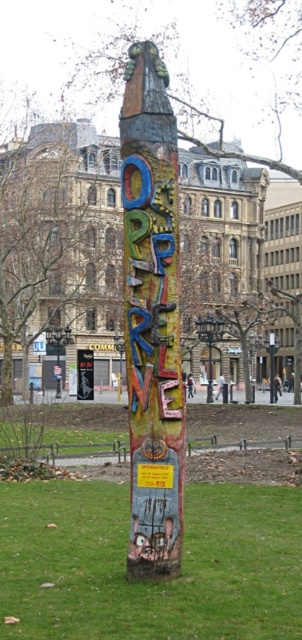
Question: Among these objects, which one is nearest to the camera?

Choices:
 (A) green grass at center
 (B) multicolored painted totem pole at center

Answer: (A)

Question: Does green grass at center appear over multicolored painted totem pole at center?

Choices:
 (A) yes
 (B) no

Answer: (B)

Question: Which point is farther from the camera taking this photo?

Choices:
 (A) (141, 390)
 (B) (231, 483)

Answer: (B)

Question: Is green grass at center above multicolored painted totem pole at center?

Choices:
 (A) yes
 (B) no

Answer: (B)

Question: Does green grass at center have a smaller size compared to multicolored painted totem pole at center?

Choices:
 (A) no
 (B) yes

Answer: (B)

Question: Which point is farther from the camera taking this photo?

Choices:
 (A) [67, 531]
 (B) [164, 99]

Answer: (A)